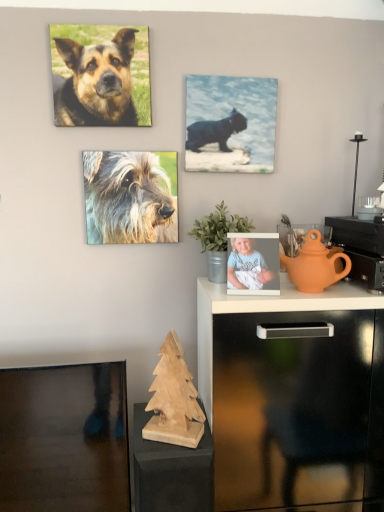
Question: Considering the positions of black glossy cat at upper center and wooden christmas tree at lower center in the image, is black glossy cat at upper center wider or thinner than wooden christmas tree at lower center?

Choices:
 (A) wide
 (B) thin

Answer: (B)

Question: From their relative heights in the image, would you say black glossy cat at upper center is taller or shorter than wooden christmas tree at lower center?

Choices:
 (A) short
 (B) tall

Answer: (A)

Question: Based on their relative distances, which object is farther from the wooden christmas tree at lower center?

Choices:
 (A) fuzzy fur dog at center, which ranks as the first dog in bottom-to-top order
 (B) light blue fabric baby at upper center
 (C) orange clay teapot at right
 (D) black glossy cat at upper center
 (E) green matte plant at center

Answer: (D)

Question: Estimate the real-world distances between objects in this image. Which object is farther from the black glossy cat at upper center?

Choices:
 (A) orange clay teapot at right
 (B) wooden christmas tree at lower center
 (C) fuzzy fur dog at center, which ranks as the second dog in top-to-bottom order
 (D) green matte plant at center
 (E) light blue fabric baby at upper center

Answer: (B)